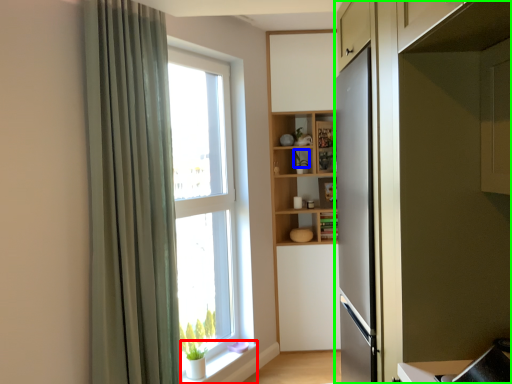
Question: Which object is positioned closest to window sill (highlighted by a red box)? Select from plant (highlighted by a blue box) and cabinetry (highlighted by a green box).

Choices:
 (A) plant
 (B) cabinetry

Answer: (A)